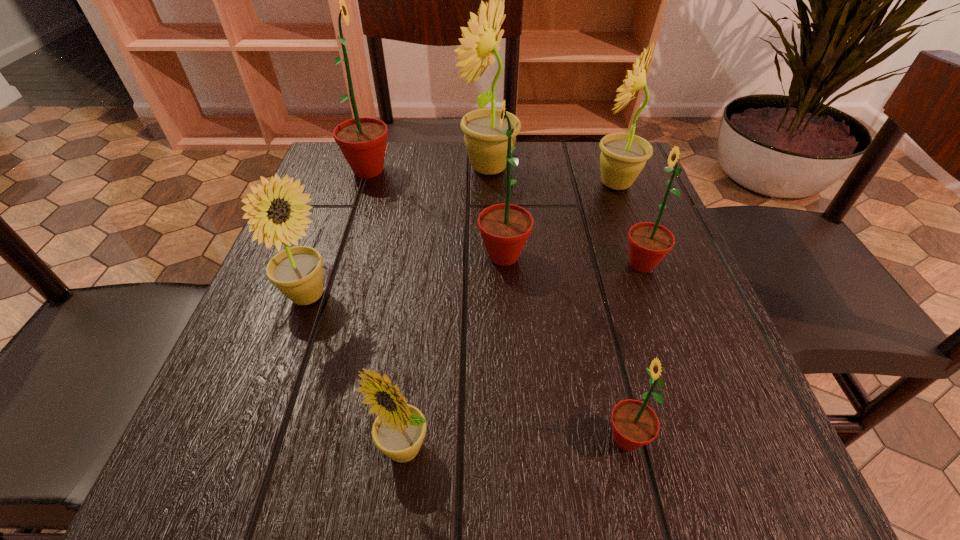
Identify the location of the nearest yellow sunflower. tap(398, 431).

You are a GUI agent. You are given a task and a screenshot of the screen. Output one action in this format:
    pyautogui.click(x=<x>, y=<y>)
    Task: Click on the sixth object from right to left
    
    Given the screenshot: What is the action you would take?
    pyautogui.click(x=398, y=431)

Locate an element on the screen. This screenshot has height=540, width=960. blank space located on the face of the biggest yellow sunflower is located at coordinates (345, 168).

Where is `vacant space positioned 0.200m on the face of the biggest yellow sunflower`? The image size is (960, 540). vacant space positioned 0.200m on the face of the biggest yellow sunflower is located at coordinates (374, 168).

This screenshot has width=960, height=540. What are the coordinates of `free spot located on the face of the biggest yellow sunflower` in the screenshot? It's located at (421, 168).

I want to click on vacant area located 0.280m on the face of the farthest green sunflower, so click(514, 170).

The width and height of the screenshot is (960, 540). Identify the location of vacant region located on the face of the rightmost yellow sunflower. pos(501,184).

The height and width of the screenshot is (540, 960). I want to click on free space located 0.180m on the face of the rightmost yellow sunflower, so click(x=510, y=184).

The image size is (960, 540). I want to click on vacant space located 0.340m on the face of the rightmost yellow sunflower, so click(439, 184).

This screenshot has height=540, width=960. Find the location of `free space located on the face of the third smallest green sunflower`. free space located on the face of the third smallest green sunflower is located at coordinates (312, 255).